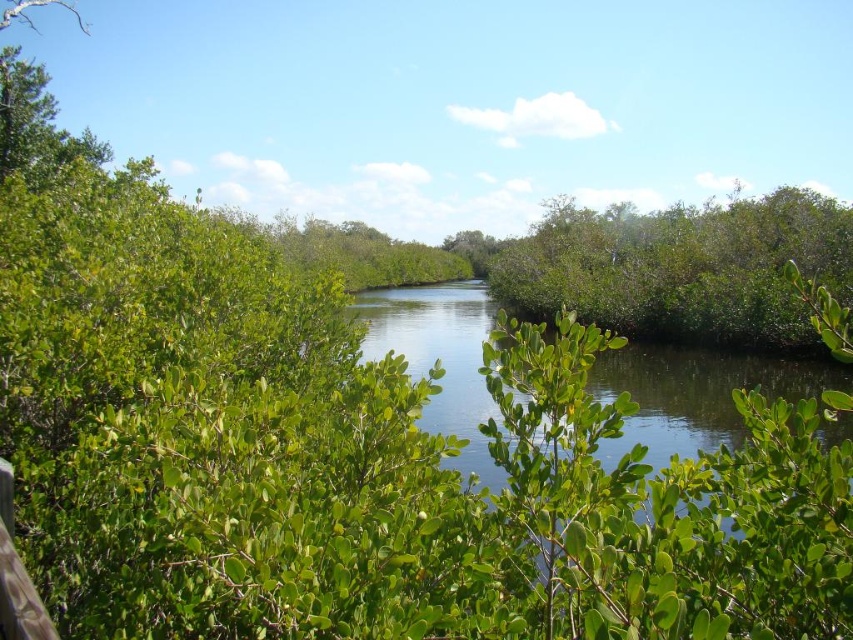
Question: Which point is farther to the camera?

Choices:
 (A) (689, 365)
 (B) (756, 260)

Answer: (B)

Question: Where is green leafy bush at center located in relation to green leafy river at center in the image?

Choices:
 (A) above
 (B) below

Answer: (A)

Question: Is green leafy bush at center to the left of green leafy river at center from the viewer's perspective?

Choices:
 (A) no
 (B) yes

Answer: (A)

Question: Which point is closer to the camera?

Choices:
 (A) green leafy river at center
 (B) green leafy bush at center

Answer: (A)

Question: Is green leafy bush at center thinner than green leafy river at center?

Choices:
 (A) no
 (B) yes

Answer: (B)